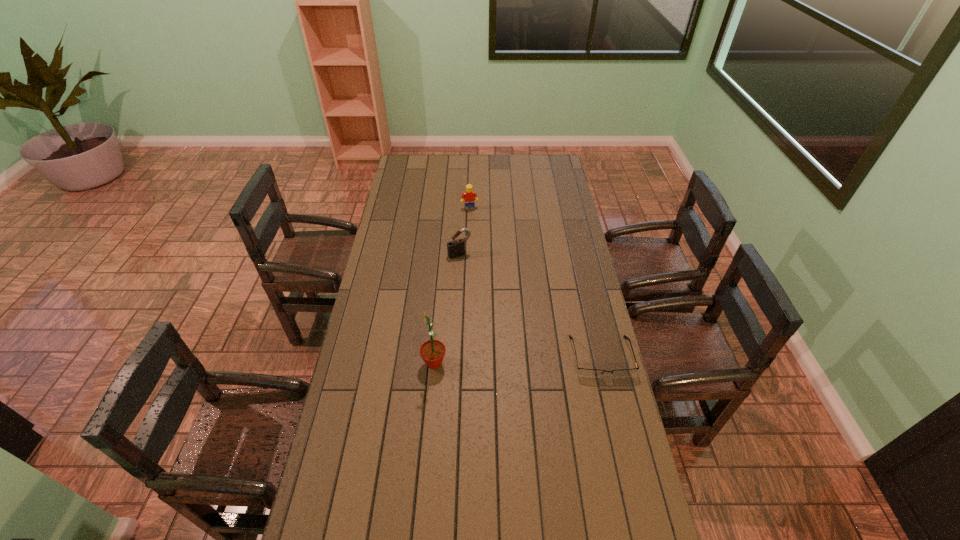
The height and width of the screenshot is (540, 960). What are the coordinates of `free region located 0.400m with the keyhole on the front of the padlock` in the screenshot? It's located at (502, 325).

At what (x,y) coordinates should I click in order to perform the action: click on vacant region located with the keyhole on the front of the padlock. Please return your answer as a coordinate pair (x, y). The image size is (960, 540). Looking at the image, I should click on (485, 294).

At what (x,y) coordinates should I click in order to perform the action: click on vacant space located on the front-facing side of the Lego. Please return your answer as a coordinate pair (x, y). This screenshot has height=540, width=960. Looking at the image, I should click on (482, 248).

At what (x,y) coordinates should I click in order to perform the action: click on vacant space situated on the front-facing side of the Lego. Please return your answer as a coordinate pair (x, y). Image resolution: width=960 pixels, height=540 pixels. Looking at the image, I should click on (484, 256).

This screenshot has height=540, width=960. In order to click on vacant space located on the front-facing side of the Lego in this screenshot , I will do `click(484, 256)`.

Locate an element on the screen. Image resolution: width=960 pixels, height=540 pixels. object at the right edge is located at coordinates (590, 373).

This screenshot has width=960, height=540. In the image, there is a desktop. Find the location of `vacant space at the far edge`. vacant space at the far edge is located at coordinates (435, 166).

Identify the location of free spot at the near edge of the desktop. (551, 502).

In the image, there is a desktop. Where is `vacant space at the left edge`? The width and height of the screenshot is (960, 540). vacant space at the left edge is located at coordinates pos(398,201).

Where is `vacant space at the right edge of the desktop`? vacant space at the right edge of the desktop is located at coordinates (556, 255).